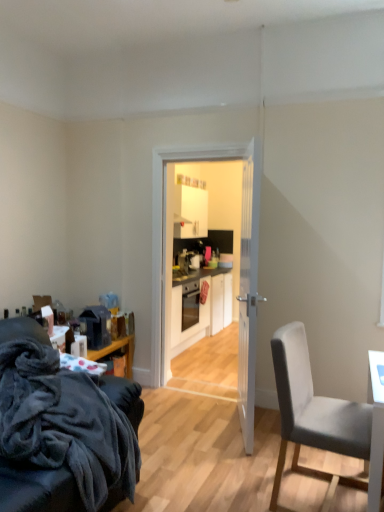
Question: From the image's perspective, is white matte cabinet at center located beneath matte black oven at center?

Choices:
 (A) no
 (B) yes

Answer: (B)

Question: Can you confirm if white matte cabinet at center is bigger than matte black oven at center?

Choices:
 (A) no
 (B) yes

Answer: (B)

Question: Is white matte cabinet at center in front of matte black oven at center?

Choices:
 (A) no
 (B) yes

Answer: (A)

Question: Is matte black oven at center inside white matte cabinet at center?

Choices:
 (A) yes
 (B) no

Answer: (B)

Question: Are white matte cabinet at center and matte black oven at center far apart?

Choices:
 (A) yes
 (B) no

Answer: (B)

Question: Considering the positions of gray fabric chair at right, which is counted as the second chair, starting from the left, and white wooden door at center in the image, is gray fabric chair at right, which is counted as the second chair, starting from the left, bigger or smaller than white wooden door at center?

Choices:
 (A) big
 (B) small

Answer: (B)

Question: From the image's perspective, is gray fabric chair at right, placed as the first chair when sorted from right to left, located above or below white wooden door at center?

Choices:
 (A) above
 (B) below

Answer: (B)

Question: From a real-world perspective, is gray fabric chair at right, placed as the first chair when sorted from right to left, above or below white wooden door at center?

Choices:
 (A) below
 (B) above

Answer: (A)

Question: Looking at their shapes, would you say gray fabric chair at right, placed as the first chair when sorted from right to left, is wider or thinner than white wooden door at center?

Choices:
 (A) wide
 (B) thin

Answer: (A)

Question: From a real-world perspective, is white glossy door at center physically located above or below white matte cabinet at center?

Choices:
 (A) below
 (B) above

Answer: (B)

Question: Looking at their shapes, would you say white glossy door at center is wider or thinner than white matte cabinet at center?

Choices:
 (A) thin
 (B) wide

Answer: (A)

Question: Looking at the image, does white glossy door at center seem bigger or smaller compared to white matte cabinet at center?

Choices:
 (A) big
 (B) small

Answer: (B)

Question: Considering the positions of point (236, 158) and point (220, 283), is point (236, 158) closer or farther from the camera than point (220, 283)?

Choices:
 (A) farther
 (B) closer

Answer: (B)

Question: From a real-world perspective, is matte black oven at center positioned above or below velvety dark gray couch at lower left, which appears as the 2th chair when viewed from the right?

Choices:
 (A) above
 (B) below

Answer: (B)

Question: Considering the positions of matte black oven at center and velvety dark gray couch at lower left, arranged as the first chair when viewed from the left, in the image, is matte black oven at center wider or thinner than velvety dark gray couch at lower left, arranged as the first chair when viewed from the left,?

Choices:
 (A) wide
 (B) thin

Answer: (B)